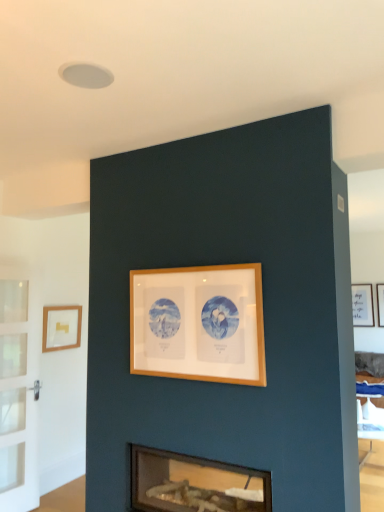
Question: From a real-world perspective, relative to matte gold picture frame at left, which appears as the 2th picture frame when viewed from the back, is white matte picture frame at upper right, the 1th picture frame when ordered from back to front, vertically above or below?

Choices:
 (A) below
 (B) above

Answer: (B)

Question: Considering the positions of point (352, 292) and point (79, 310), is point (352, 292) closer or farther from the camera than point (79, 310)?

Choices:
 (A) closer
 (B) farther

Answer: (A)

Question: Estimate the real-world distances between objects in this image. Which object is closer to the matte glass fireplace at lower center?

Choices:
 (A) white matte picture frame at upper right, which is counted as the 3th picture frame, starting from the left
 (B) wooden frame at center, the 2th picture frame viewed from the right
 (C) matte gold picture frame at left, the second picture frame from the front
 (D) clear glass door at left

Answer: (B)

Question: Which of these objects is positioned farthest from the wooden frame at center, the 2th picture frame viewed from the right?

Choices:
 (A) matte gold picture frame at left, which is the 1th picture frame from left to right
 (B) matte glass fireplace at lower center
 (C) clear glass door at left
 (D) white matte picture frame at upper right, acting as the 1th picture frame starting from the right

Answer: (A)